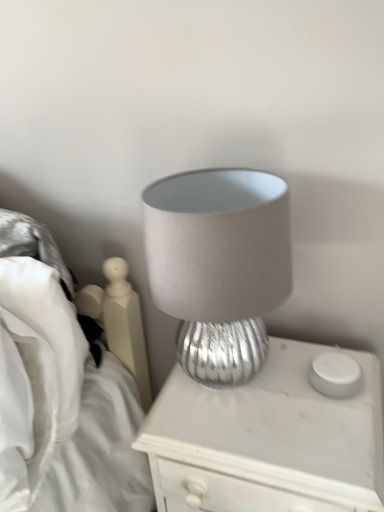
The height and width of the screenshot is (512, 384). Identify the location of free space in front of satin gray lampshade at center. (263, 442).